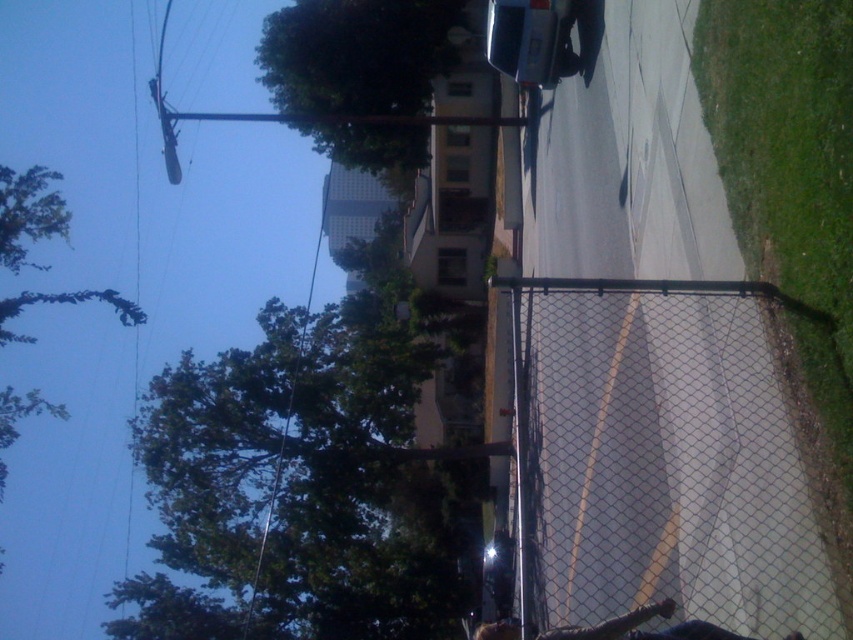
Does green leafy tree at upper left have a greater height compared to metallic wire at upper left?

No.

Measure the distance between point (61, 227) and camera.

Point (61, 227) and camera are 77.44 feet apart.

Identify the location of green leafy tree at upper left. (28, 212).

Is point (316, 497) positioned in front of point (270, 508)?

No, it is behind (270, 508).

This screenshot has height=640, width=853. Describe the element at coordinates (310, 476) in the screenshot. I see `green leafy tree at center` at that location.

Identify the location of green leafy tree at center. This screenshot has height=640, width=853. (310, 476).

You are a GUI agent. You are given a task and a screenshot of the screen. Output one action in this format:
    pyautogui.click(x=<x>, y=<y>)
    Task: Click on the green leafy tree at center
    The image size is (853, 640).
    Given the screenshot: What is the action you would take?
    pyautogui.click(x=310, y=476)

Does point (386, 17) lie behind point (38, 236)?

Yes, point (386, 17) is behind point (38, 236).

Locate an element on the screen. The height and width of the screenshot is (640, 853). green leafy tree at upper center is located at coordinates (357, 54).

This screenshot has height=640, width=853. In order to click on green leafy tree at upper center in this screenshot , I will do [357, 54].